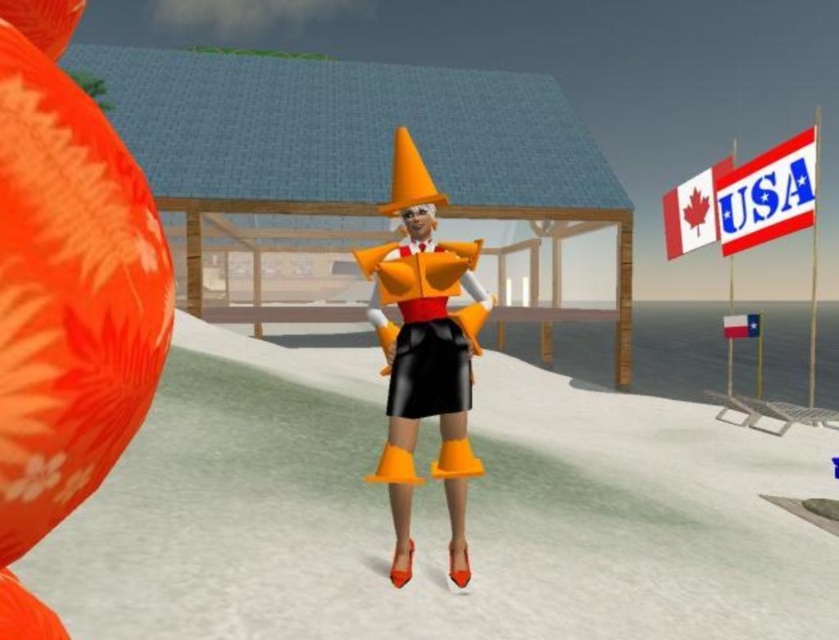
Question: Is matte orange cone at center bigger than white fabric flag at upper right?

Choices:
 (A) yes
 (B) no

Answer: (A)

Question: Which is nearer to the white paper flag at upper right?

Choices:
 (A) matte orange cone at center
 (B) red fabric flag at lower right
 (C) white fabric flag at upper right

Answer: (C)

Question: Is black leather dress at center behind red fabric flag at lower right?

Choices:
 (A) yes
 (B) no

Answer: (B)

Question: Which point is farther to the camera?

Choices:
 (A) (465, 392)
 (B) (662, 209)
 (C) (780, 221)
 (D) (368, 307)

Answer: (B)

Question: Which of the following is the closest to the observer?

Choices:
 (A) (775, 163)
 (B) (400, 488)
 (C) (759, 328)
 (D) (668, 221)

Answer: (B)

Question: Is matte orange cone at center bigger than red fabric flag at lower right?

Choices:
 (A) yes
 (B) no

Answer: (B)